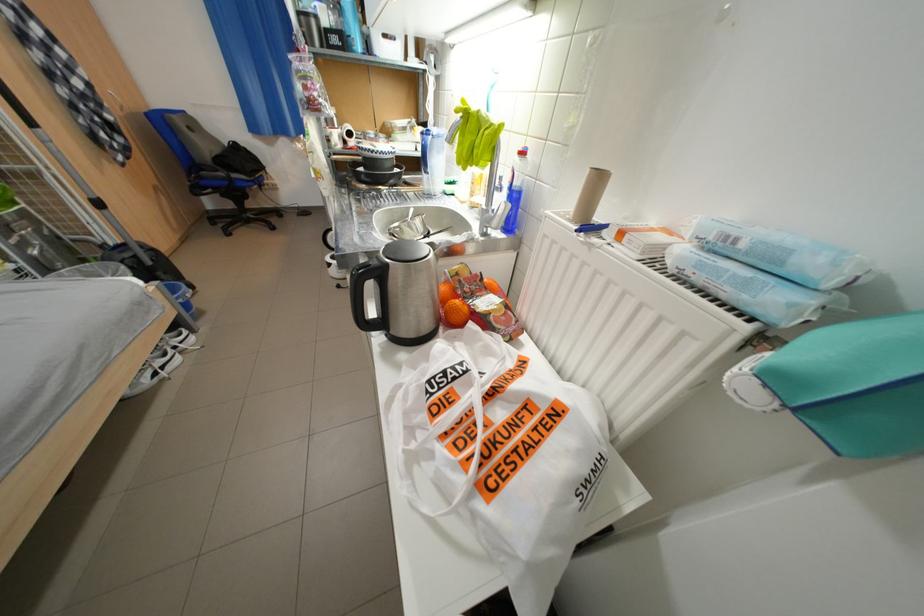
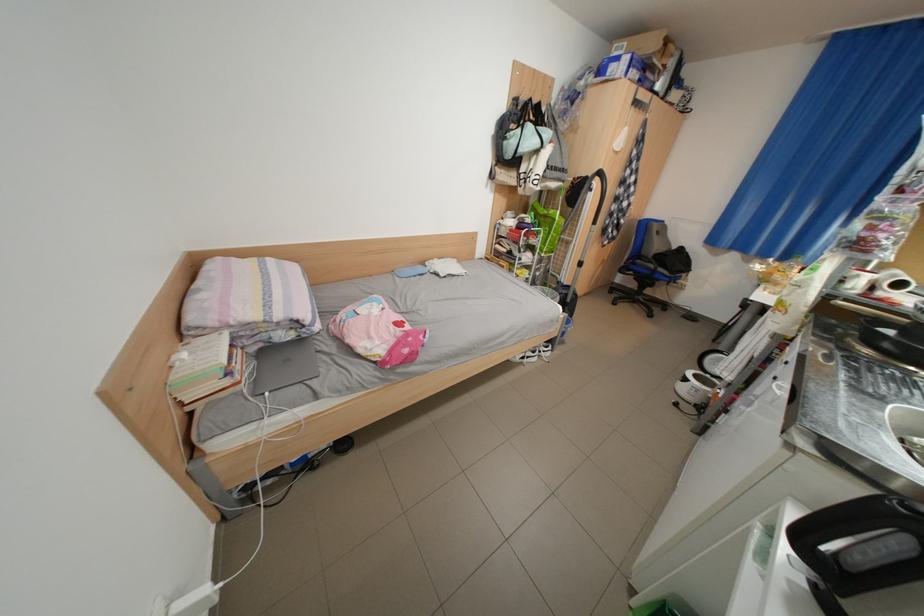
Find the pixel in the second image that matches point (256, 164) in the first image.

(687, 264)